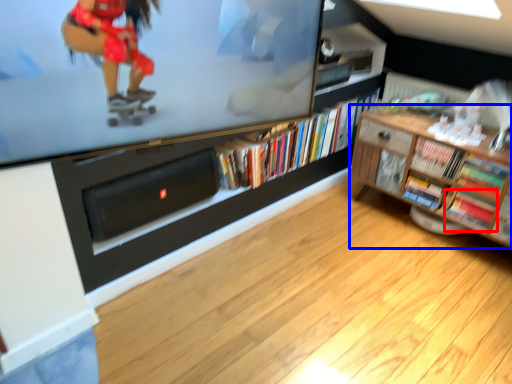
Question: Which object appears farthest to the camera in this image, book (highlighted by a red box) or shelf (highlighted by a blue box)?

Choices:
 (A) book
 (B) shelf

Answer: (A)